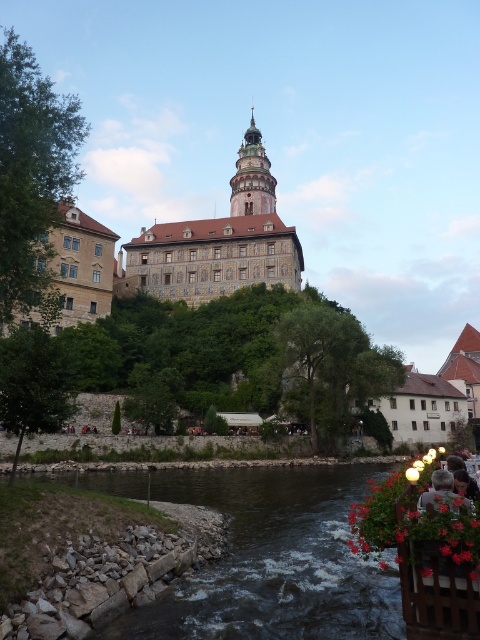
Question: Which object is closer to the camera taking this photo?

Choices:
 (A) dark brown stone river at lower center
 (B) dark brown stone tower at center

Answer: (A)

Question: Can you confirm if dark brown stone river at lower center is smaller than stone mosaic building at center?

Choices:
 (A) no
 (B) yes

Answer: (B)

Question: Which point appears closest to the camera in this image?

Choices:
 (A) (262, 193)
 (B) (327, 512)
 (C) (144, 243)

Answer: (B)

Question: Among these points, which one is farthest from the camera?

Choices:
 (A) (368, 632)
 (B) (272, 252)
 (C) (229, 182)

Answer: (C)

Question: Does dark brown stone river at lower center have a larger size compared to dark brown stone tower at center?

Choices:
 (A) yes
 (B) no

Answer: (B)

Question: Is dark brown stone river at lower center below stone mosaic building at center?

Choices:
 (A) no
 (B) yes

Answer: (B)